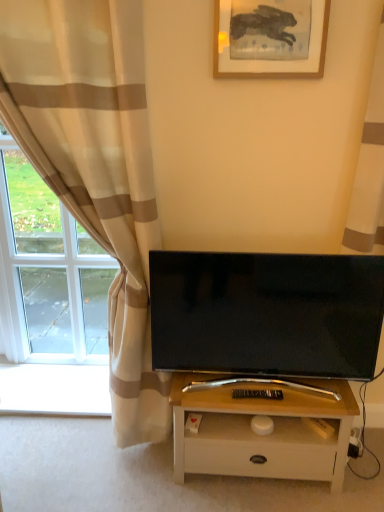
Find the location of a particular element. The width and height of the screenshot is (384, 512). free spot above white wood table at center (from a real-world perspective) is located at coordinates (261, 391).